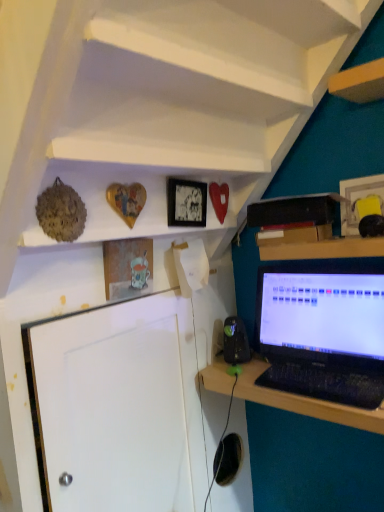
Question: From the image's perspective, relative to wooden heart at upper center, arranged as the 2th shelf when viewed from the top, is black plastic speaker at lower center above or below?

Choices:
 (A) below
 (B) above

Answer: (A)

Question: From a real-world perspective, is black plastic speaker at lower center positioned above or below wooden heart at upper center, arranged as the 2th shelf when viewed from the top?

Choices:
 (A) below
 (B) above

Answer: (A)

Question: Which of these objects is positioned closest to the wooden heart at upper center, arranged as the 2th shelf when viewed from the top?

Choices:
 (A) matte glass picture frame at upper center, which is counted as the 3th picture frame, starting from the right
 (B) wooden picture frame at upper right, placed as the 1th picture frame when sorted from right to left
 (C) white matte shelf at upper center, arranged as the first shelf when viewed from the top
 (D) black plastic speaker at lower center
 (E) black glossy laptop at right

Answer: (A)

Question: Which is nearer to the wooden desk at lower right?

Choices:
 (A) black glossy laptop at right
 (B) matte black picture frame at upper center, which ranks as the 2th picture frame in left-to-right order
 (C) white matte shelf at upper center, arranged as the first shelf when viewed from the top
 (D) matte glass picture frame at upper center, which is counted as the 3th picture frame, starting from the right
 (E) black plastic speaker at lower center

Answer: (A)